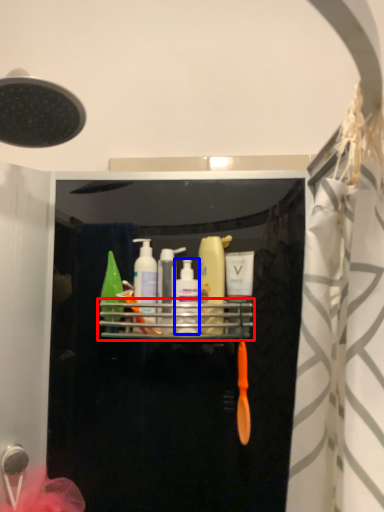
Question: Which of the following is the closest to the observer, shelf (highlighted by a red box) or mouthwash (highlighted by a blue box)?

Choices:
 (A) shelf
 (B) mouthwash

Answer: (A)